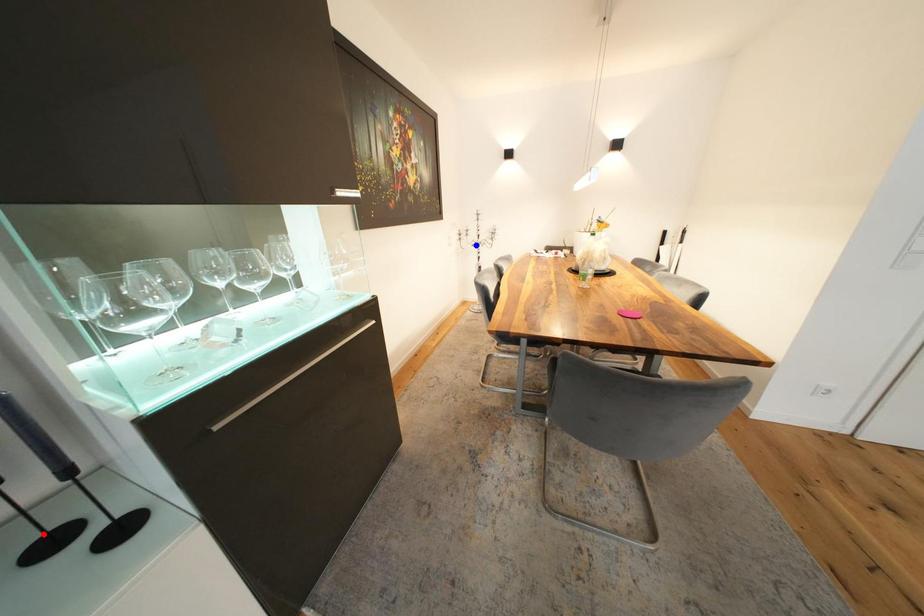
Question: Which of the two points in the image is closer to the camera?

Choices:
 (A) Blue point is closer.
 (B) Red point is closer.

Answer: (B)